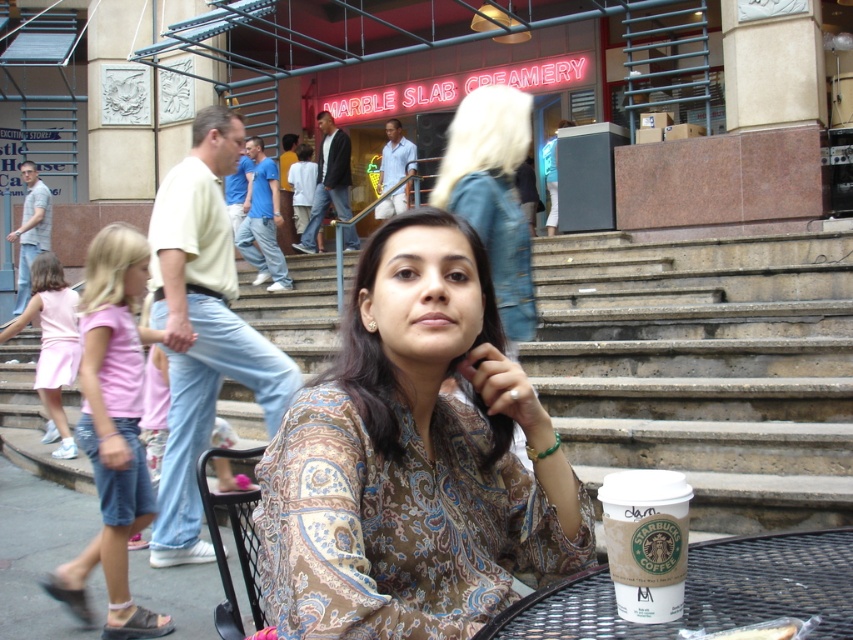
Can you confirm if brown paisley shirt at center is thinner than pink fabric dress at lower left?

Correct, brown paisley shirt at center's width is less than pink fabric dress at lower left's.

Between point (567, 564) and point (57, 408), which one is positioned in front?

Point (567, 564) is in front.

The height and width of the screenshot is (640, 853). What are the coordinates of `brown paisley shirt at center` in the screenshot? It's located at (413, 458).

Identify the location of brown paisley shirt at center. This screenshot has width=853, height=640. (413, 458).

The width and height of the screenshot is (853, 640). What are the coordinates of `brown paisley shirt at center` in the screenshot? It's located at (413, 458).

Does brown paisley shirt at center appear on the left side of metallic mesh table at lower center?

Correct, you'll find brown paisley shirt at center to the left of metallic mesh table at lower center.

Which is in front, point (505, 596) or point (712, 602)?

Point (712, 602)

Where is `brown paisley shirt at center`? The image size is (853, 640). brown paisley shirt at center is located at coordinates (413, 458).

Is printed silk blouse at center bigger than pink fabric dress at lower left?

No.

Which of these two, printed silk blouse at center or pink fabric dress at lower left, stands shorter?

printed silk blouse at center is shorter.

The image size is (853, 640). Describe the element at coordinates (492, 195) in the screenshot. I see `printed silk blouse at center` at that location.

Locate an element on the screen. The image size is (853, 640). printed silk blouse at center is located at coordinates (492, 195).